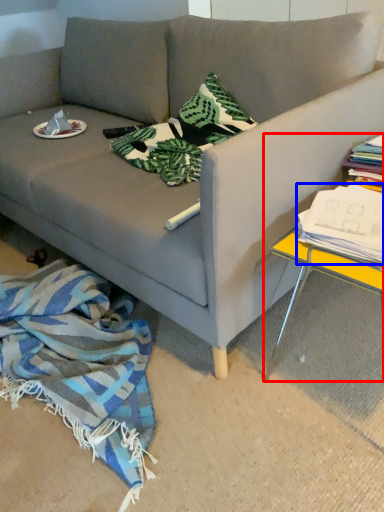
Question: Among these objects, which one is farthest to the camera, table (highlighted by a red box) or magazine (highlighted by a blue box)?

Choices:
 (A) table
 (B) magazine

Answer: (B)